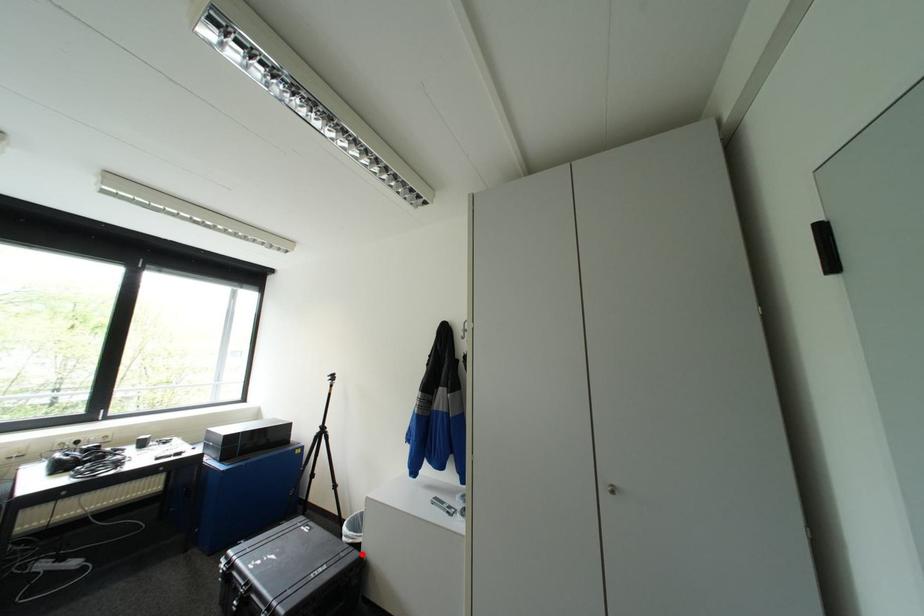
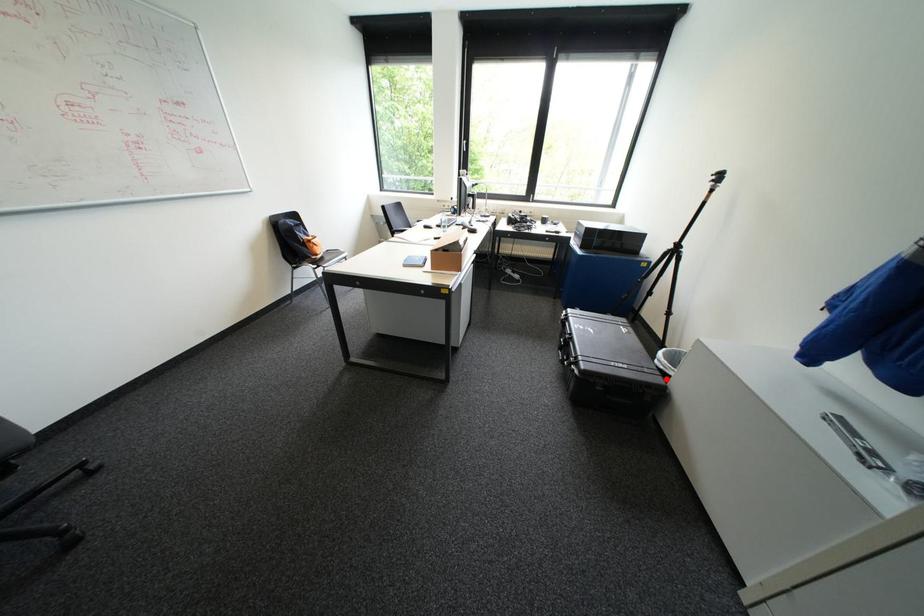
I am providing you with two images of the same scene from different viewpoints. A red point is marked on the first image and another point is marked on the second image. Does the point marked in image1 correspond to the same location as the one in image2?

Yes